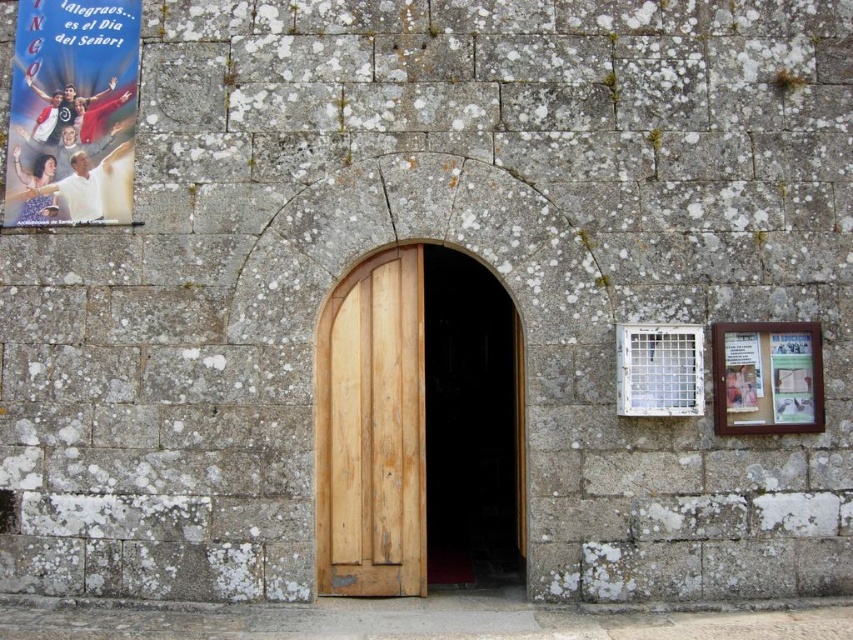
Based on the photo, you are an interior designer planning to hang a new poster that is the same size as the light brown wood door at center. Where should you place it so that it doesn not exceed the space currently occupied by the matte paper poster at upper left?

The light brown wood door at center is narrower than the matte paper poster at upper left, so placing the new poster of the door at center next to or above the existing poster at upper left would ensure it fits within the available space without exceeding it.

You are a delivery person who needs to deliver a package to the building. The door must be accessible to reach the entrance. Is the light brown wood door at center blocking the matte paper poster at upper left from view?

The light brown wood door at center is in front of the matte paper poster at upper left, so yes, the door is blocking the poster from view.